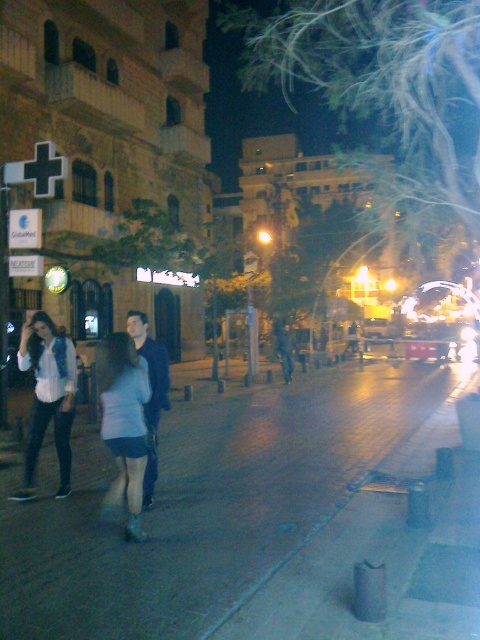
Question: Is light blue denim shorts at center to the left of denim jacket at left from the viewer's perspective?

Choices:
 (A) no
 (B) yes

Answer: (A)

Question: Among these objects, which one is farthest from the camera?

Choices:
 (A) light blue denim shorts at center
 (B) denim jacket at left

Answer: (B)

Question: Can you confirm if smooth concrete sidewalk at lower center is smaller than denim jacket at left?

Choices:
 (A) no
 (B) yes

Answer: (A)

Question: Can you confirm if smooth concrete sidewalk at lower center is positioned below light blue denim shorts at center?

Choices:
 (A) yes
 (B) no

Answer: (A)

Question: Which of the following is the farthest from the observer?

Choices:
 (A) denim jacket at left
 (B) light blue denim shorts at center

Answer: (A)

Question: Which point appears farthest from the camera in this image?

Choices:
 (A) (121, 397)
 (B) (57, 394)

Answer: (B)